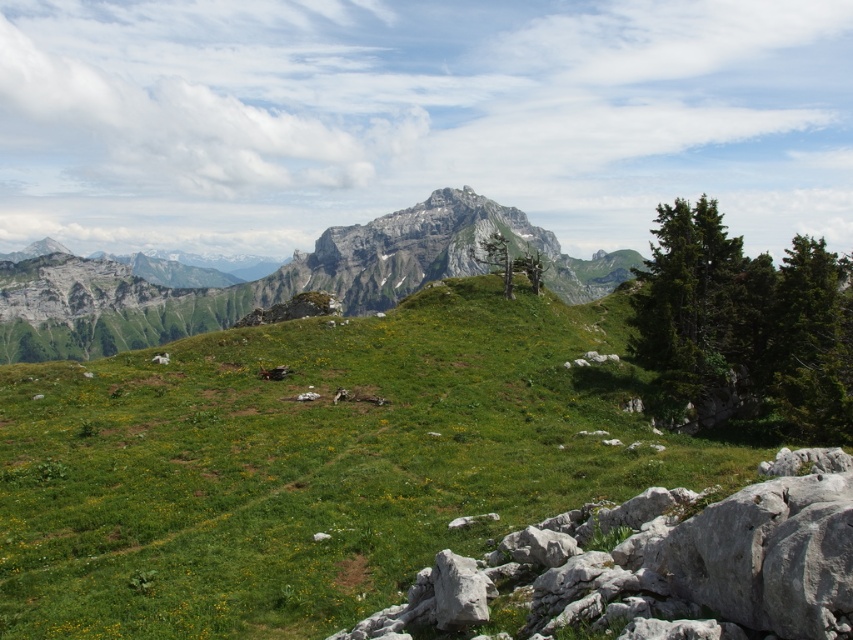
Question: Is white rock at lower right bigger than rugged stone mountain at center?

Choices:
 (A) no
 (B) yes

Answer: (A)

Question: Which of the following is the farthest from the observer?

Choices:
 (A) (136, 301)
 (B) (434, 572)

Answer: (A)

Question: Is white rock at lower right further to camera compared to rugged stone mountain at center?

Choices:
 (A) yes
 (B) no

Answer: (B)

Question: Does white rock at lower right come in front of rugged stone mountain at center?

Choices:
 (A) no
 (B) yes

Answer: (B)

Question: Which point is farther from the camera taking this photo?

Choices:
 (A) (479, 298)
 (B) (463, 612)
 (C) (349, 241)

Answer: (C)

Question: Which of the following is the closest to the observer?

Choices:
 (A) (468, 602)
 (B) (537, 422)

Answer: (A)